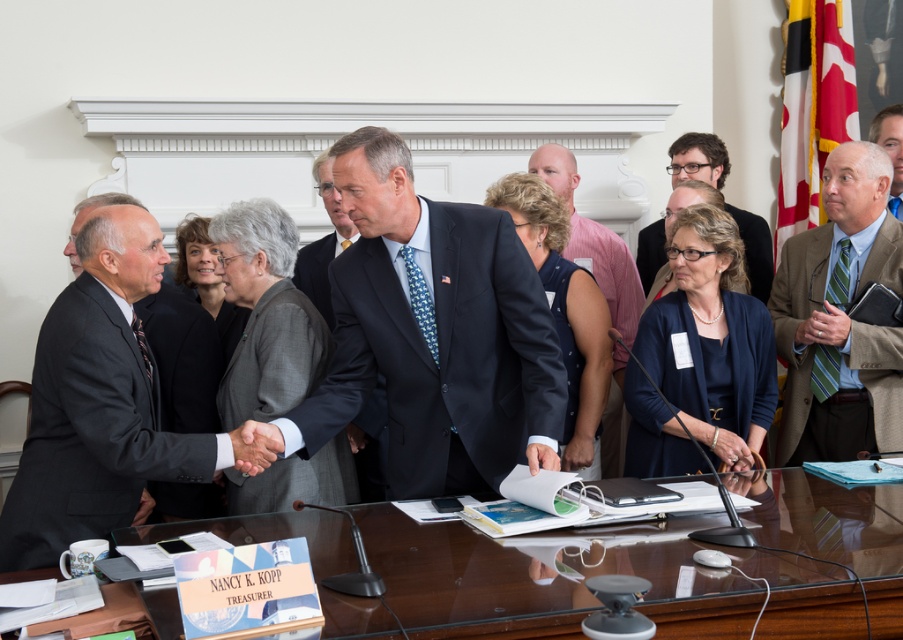
Who is shorter, pink cotton shirt at center or smooth skin handshake at center?

With less height is smooth skin handshake at center.

Does point (621, 308) come closer to viewer compared to point (231, 442)?

No, it is not.

Between point (596, 252) and point (247, 445), which one is positioned behind?

Positioned behind is point (596, 252).

At what (x,y) coordinates should I click in order to perform the action: click on pink cotton shirt at center. Please return your answer as a coordinate pair (x, y). The width and height of the screenshot is (903, 640). Looking at the image, I should click on (593, 241).

Looking at this image, how distant is pink cotton shirt at center from gray fabric suit at center?

pink cotton shirt at center and gray fabric suit at center are 1.59 meters apart from each other.

In the scene shown: Is pink cotton shirt at center above gray fabric suit at center?

No.

I want to click on pink cotton shirt at center, so click(x=593, y=241).

Image resolution: width=903 pixels, height=640 pixels. In order to click on pink cotton shirt at center in this screenshot , I will do `click(593, 241)`.

Is transparent glass table at center to the right of dark gray wool suit at center from the viewer's perspective?

Correct, you'll find transparent glass table at center to the right of dark gray wool suit at center.

Is point (267, 525) in front of point (333, 440)?

Yes.

Where is `transparent glass table at center`? Image resolution: width=903 pixels, height=640 pixels. transparent glass table at center is located at coordinates (545, 577).